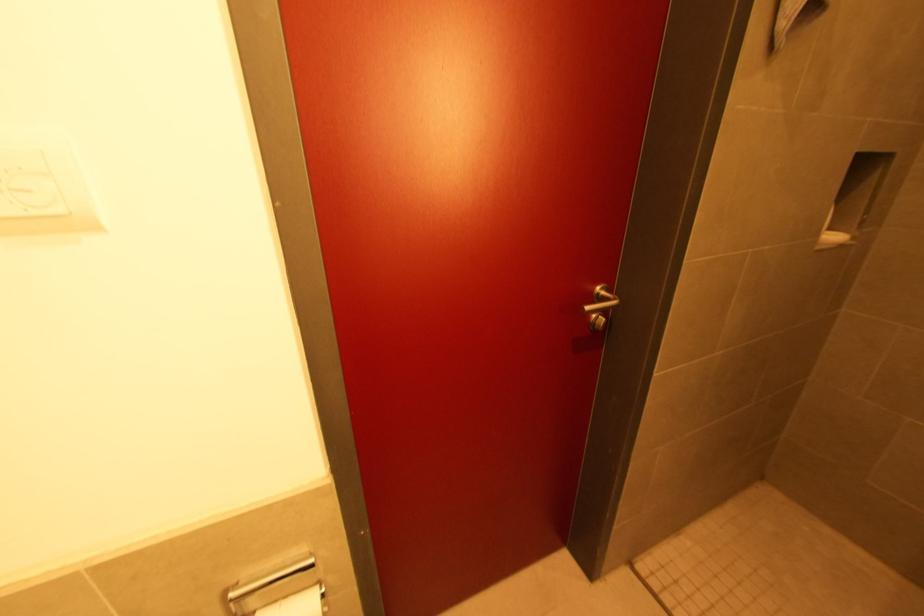
You are a GUI agent. You are given a task and a screenshot of the screen. Output one action in this format:
    pyautogui.click(x=<x>, y=<y>)
    Task: Click on the white wall dial
    This screenshot has height=616, width=924.
    Given the screenshot: What is the action you would take?
    pyautogui.click(x=43, y=185)